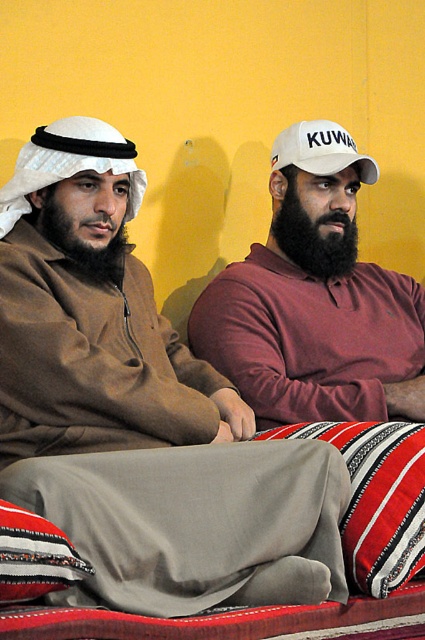
Is maroon cotton shirt at center wider than white fabric baseball cap at upper right?

Yes, maroon cotton shirt at center is wider than white fabric baseball cap at upper right.

Locate an element on the screen. The height and width of the screenshot is (640, 425). maroon cotton shirt at center is located at coordinates (314, 300).

Does point (274, 220) come farther from viewer compared to point (416, 522)?

Yes, it is.

Is point (261, 285) positioned before point (357, 509)?

No, it is behind (357, 509).

I want to click on maroon cotton shirt at center, so click(314, 300).

The height and width of the screenshot is (640, 425). Find the location of `maroon cotton shirt at center`. maroon cotton shirt at center is located at coordinates (314, 300).

Does white matte cap at upper right appear under white fabric baseball cap at upper right?

Yes, white matte cap at upper right is below white fabric baseball cap at upper right.

In the scene shown: Is the position of white matte cap at upper right more distant than that of white fabric baseball cap at upper right?

No, it is not.

Between point (169, 545) and point (328, 145), which one is positioned behind?

The point (328, 145) is more distant.

The width and height of the screenshot is (425, 640). What are the coordinates of `white matte cap at upper right` in the screenshot? It's located at (139, 408).